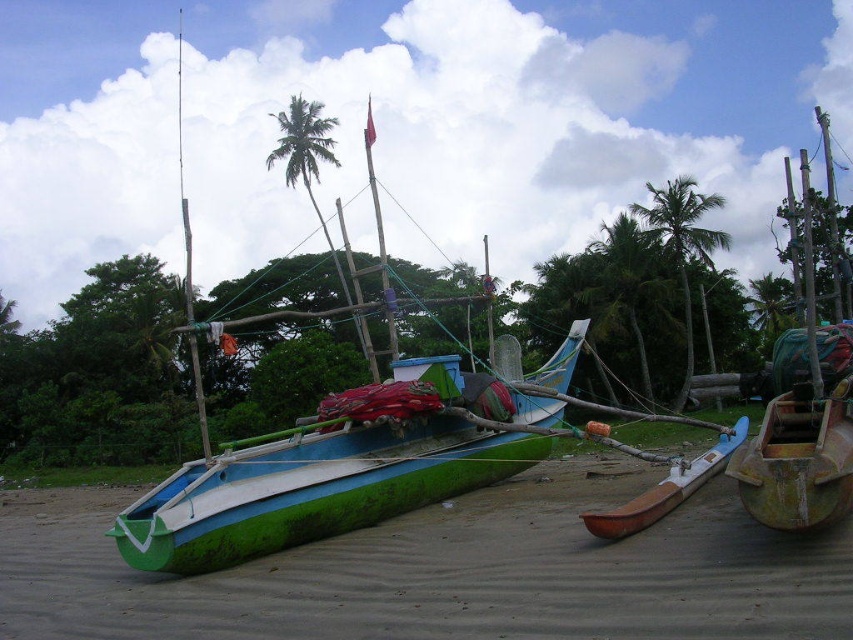
You are standing on the beach looking at the boats. There are two points marked on the scene. Which point, point (404, 625) or point (653, 214), is closer to you?

Point (404, 625) is closer to the viewer than point (653, 214).

You are a photographer standing on the beach and want to capture both the green wood boat at center and the brown wood canoe at lower right in a single shot. Based on their positions, which boat should you focus on first to ensure both are in frame?

Since the green wood boat at center is to the left of the brown wood canoe at lower right, you should focus on the green wood boat at center first as it is positioned further left, allowing you to frame both boats from left to right in your shot.